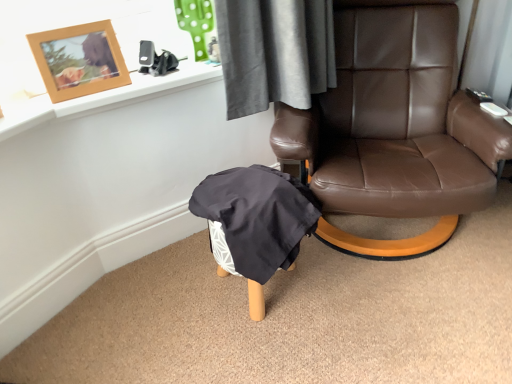
Question: From the image's perspective, is black plastic remote control at upper right, which appears as the 2th remote control when viewed from the front, located above or below brown leather chair at center?

Choices:
 (A) below
 (B) above

Answer: (B)

Question: Considering the positions of black plastic remote control at upper right, acting as the 2th remote control starting from the bottom, and brown leather chair at center in the image, is black plastic remote control at upper right, acting as the 2th remote control starting from the bottom, bigger or smaller than brown leather chair at center?

Choices:
 (A) small
 (B) big

Answer: (A)

Question: Which object is the closest to the woodenobject at upper left?

Choices:
 (A) brown leather chair at center
 (B) dark gray fabric bean bag chair at lower center
 (C) black plastic remote control at upper right, which appears as the 2th remote control when viewed from the front
 (D) black plastic remote control at upper right, arranged as the second remote control when viewed from the top

Answer: (B)

Question: Estimate the real-world distances between objects in this image. Which object is closer to the black plastic remote control at upper right, the first remote control in the top-to-bottom sequence?

Choices:
 (A) woodenobject at upper left
 (B) brown leather chair at center
 (C) dark gray fabric bean bag chair at lower center
 (D) black plastic remote control at upper right, acting as the 2th remote control starting from the back

Answer: (D)